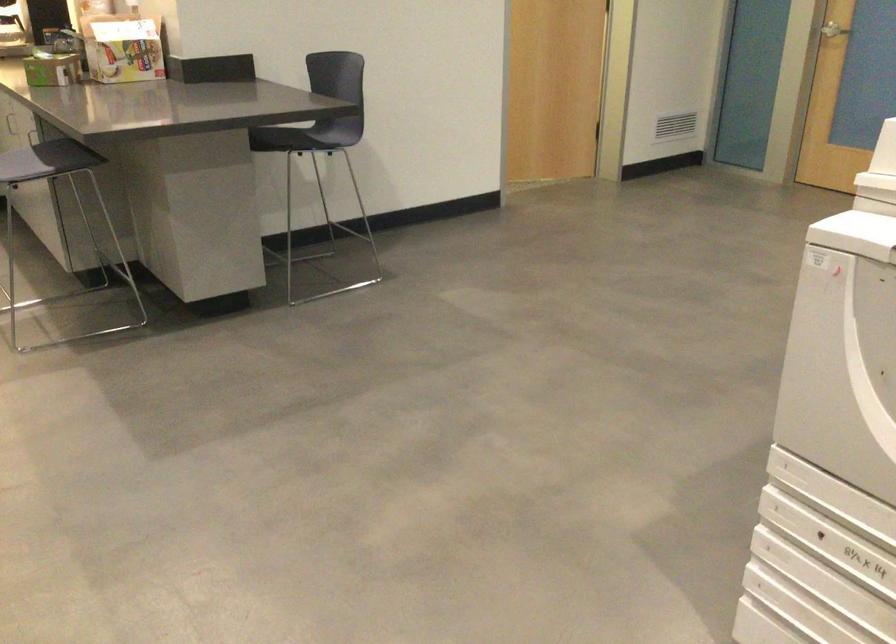
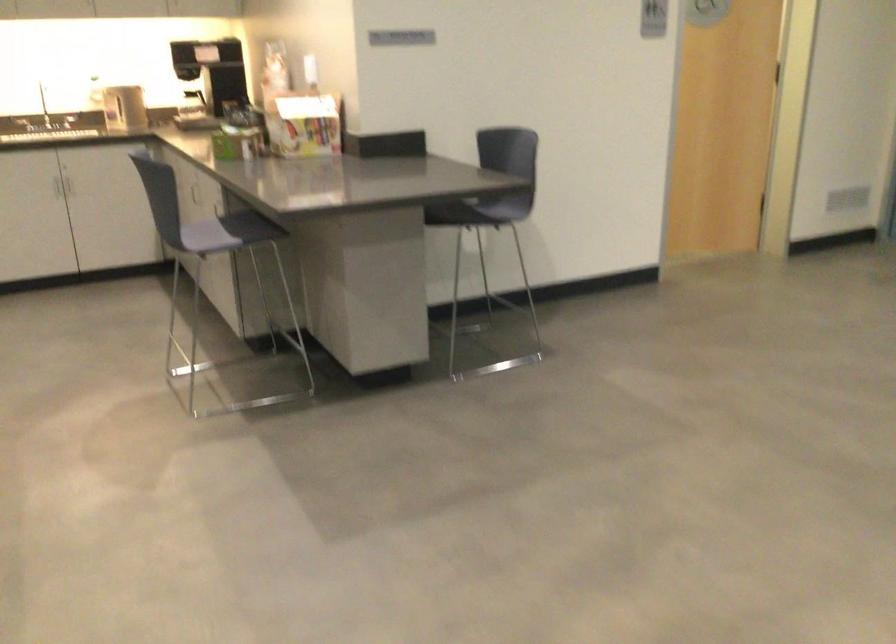
Question: The first image is from the beginning of the video and the second image is from the end. How did the camera likely rotate when shooting the video?

Choices:
 (A) Left
 (B) Right
 (C) Up
 (D) Down

Answer: (A)